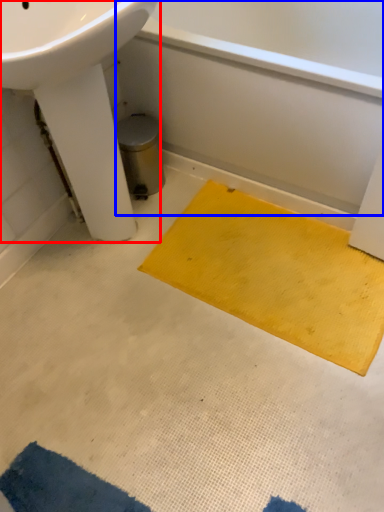
Question: Which point is further to the camera, sink (highlighted by a red box) or bath (highlighted by a blue box)?

Choices:
 (A) sink
 (B) bath

Answer: (B)